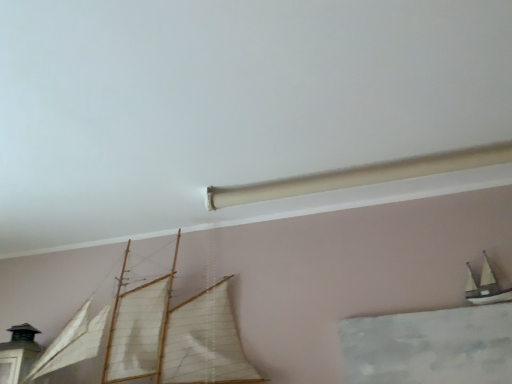
Question: From the image's perspective, is white matte sailboat at upper right, arranged as the 1th boat when viewed from the right, on top of wooden sailboat at center, the 1th boat positioned from the left?

Choices:
 (A) no
 (B) yes

Answer: (B)

Question: Can you confirm if white matte sailboat at upper right, placed as the second boat when sorted from left to right, is taller than wooden sailboat at center, the 2th boat viewed from the right?

Choices:
 (A) yes
 (B) no

Answer: (B)

Question: Considering the relative sizes of white matte sailboat at upper right, arranged as the 1th boat when viewed from the right, and wooden sailboat at center, the 2th boat viewed from the right, in the image provided, is white matte sailboat at upper right, arranged as the 1th boat when viewed from the right, bigger than wooden sailboat at center, the 2th boat viewed from the right,?

Choices:
 (A) yes
 (B) no

Answer: (B)

Question: Is white matte sailboat at upper right, arranged as the 1th boat when viewed from the right, positioned beyond the bounds of wooden sailboat at center, the 2th boat viewed from the right?

Choices:
 (A) no
 (B) yes

Answer: (B)

Question: Does white matte sailboat at upper right, placed as the second boat when sorted from left to right, have a lesser height compared to wooden sailboat at center, the 1th boat positioned from the left?

Choices:
 (A) no
 (B) yes

Answer: (B)

Question: Can you confirm if white matte sailboat at upper right, arranged as the 1th boat when viewed from the right, is positioned to the left of wooden sailboat at center, the 1th boat positioned from the left?

Choices:
 (A) no
 (B) yes

Answer: (A)

Question: From a real-world perspective, is wooden sailboat at center, the 1th boat positioned from the left, located beneath white matte sailboat at upper right, placed as the second boat when sorted from left to right?

Choices:
 (A) no
 (B) yes

Answer: (A)

Question: Could white matte sailboat at upper right, placed as the second boat when sorted from left to right, be considered to be inside wooden sailboat at center, the 2th boat viewed from the right?

Choices:
 (A) no
 (B) yes

Answer: (A)

Question: Is wooden sailboat at center, the 1th boat positioned from the left, looking in the opposite direction of white matte sailboat at upper right, arranged as the 1th boat when viewed from the right?

Choices:
 (A) yes
 (B) no

Answer: (B)

Question: From a real-world perspective, is wooden sailboat at center, the 1th boat positioned from the left, on white matte sailboat at upper right, placed as the second boat when sorted from left to right?

Choices:
 (A) yes
 (B) no

Answer: (A)

Question: From the image's perspective, is wooden sailboat at center, the 1th boat positioned from the left, under white matte sailboat at upper right, placed as the second boat when sorted from left to right?

Choices:
 (A) yes
 (B) no

Answer: (A)

Question: Does wooden sailboat at center, the 2th boat viewed from the right, have a lesser height compared to white matte sailboat at upper right, arranged as the 1th boat when viewed from the right?

Choices:
 (A) yes
 (B) no

Answer: (B)

Question: In the image, is wooden sailboat at center, the 2th boat viewed from the right, on the left side or the right side of white matte sailboat at upper right, arranged as the 1th boat when viewed from the right?

Choices:
 (A) left
 (B) right

Answer: (A)